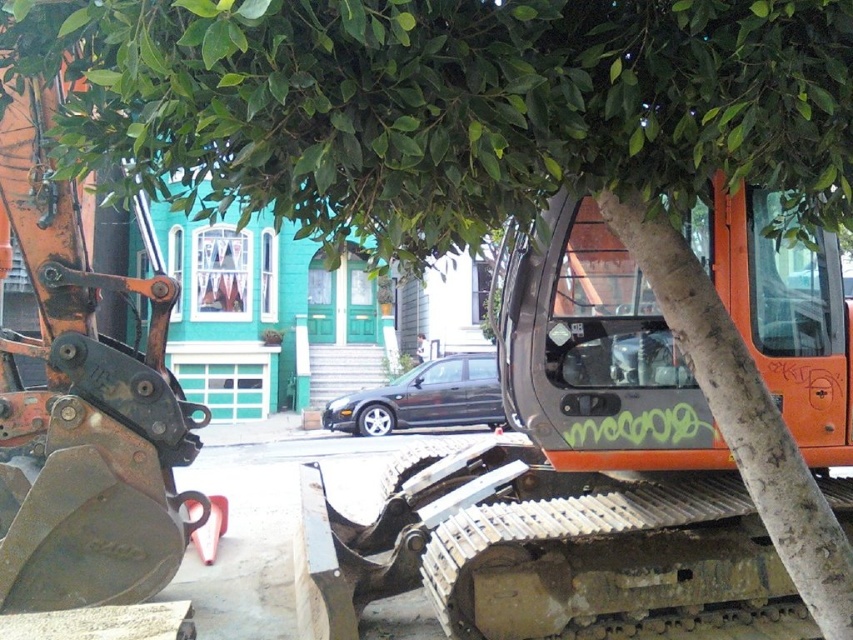
You are a bird looking for a place to perch. You see a green leafy tree at upper center and a rusty metal excavator at left. Which one is shorter and thus safer for landing?

The green leafy tree at upper center is shorter than the rusty metal excavator at left, making it a safer option for landing.

You are a delivery person trying to deliver a package to the turquoise house. The path to the house is blocked by the rusty metal excavator at left and the green leafy tree at upper center. Can you pass through the gap between them?

The gap between the green leafy tree at upper center and the rusty metal excavator at left is 1.54 meters. Since the delivery person is likely narrower than this width, they can pass through the gap.

You are standing at the point marked by the coordinates point (x=453, y=109). What object is located at this point?

The point (x=453, y=109) indicates a green leafy tree at upper center.